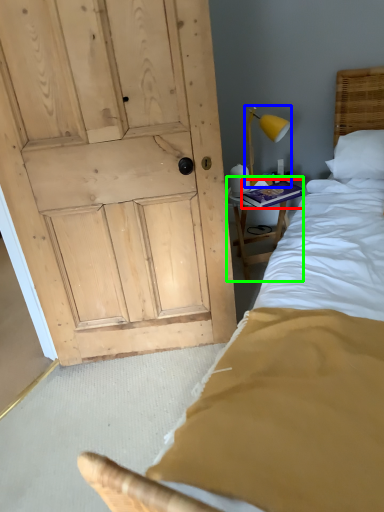
Question: Estimate the real-world distances between objects in this image. Which object is closer to book (highlighted by a red box), bedside lamp (highlighted by a blue box) or furniture (highlighted by a green box)?

Choices:
 (A) bedside lamp
 (B) furniture

Answer: (B)